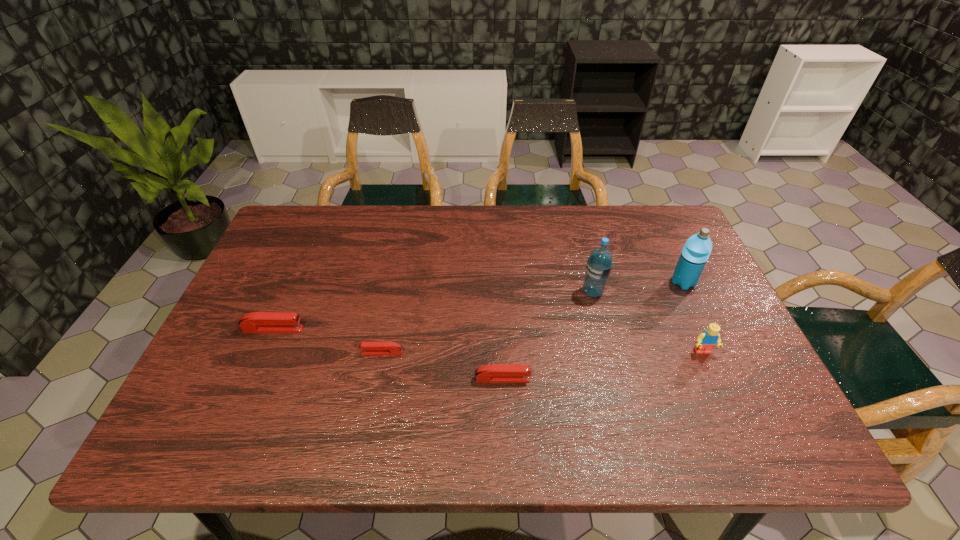
Observe the arrangement of all staplers in the image. To keep them evenly spaced, where would you place another stapler on the right? Please locate a free space. Please provide its 2D coordinates. Your answer should be formatted as a tuple, i.e. [(x, y)], where the tuple contains the x and y coordinates of a point satisfying the conditions above.

[(636, 408)]